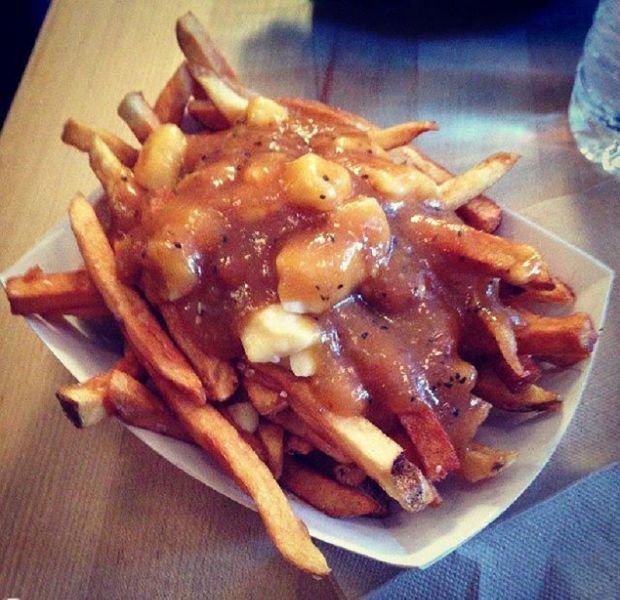
Where is `edge of napkin`? This screenshot has height=600, width=620. edge of napkin is located at coordinates (575, 484).